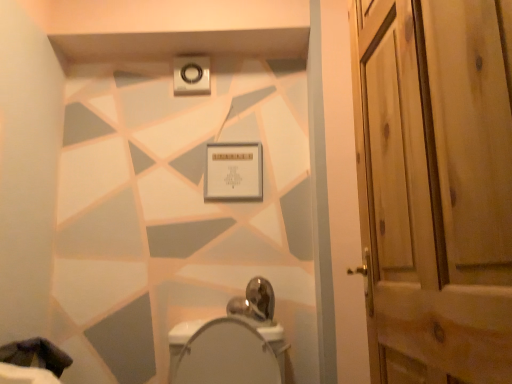
Question: Is white glossy bidet at center smaller than wooden door at right?

Choices:
 (A) no
 (B) yes

Answer: (A)

Question: Is white glossy bidet at center closer to the viewer compared to wooden door at right?

Choices:
 (A) yes
 (B) no

Answer: (B)

Question: Considering the relative sizes of white glossy bidet at center and wooden door at right in the image provided, is white glossy bidet at center taller than wooden door at right?

Choices:
 (A) yes
 (B) no

Answer: (B)

Question: Is wooden door at right completely or partially inside white glossy bidet at center?

Choices:
 (A) no
 (B) yes

Answer: (A)

Question: Is white glossy bidet at center shorter than wooden door at right?

Choices:
 (A) no
 (B) yes

Answer: (B)

Question: In terms of size, does white glossy bidet at center appear bigger or smaller than dark fabric at lower left?

Choices:
 (A) small
 (B) big

Answer: (B)

Question: From the image's perspective, is white glossy bidet at center located above or below dark fabric at lower left?

Choices:
 (A) above
 (B) below

Answer: (A)

Question: Is point (185, 344) closer or farther from the camera than point (31, 364)?

Choices:
 (A) closer
 (B) farther

Answer: (B)

Question: Is white glossy bidet at center inside or outside of dark fabric at lower left?

Choices:
 (A) inside
 (B) outside

Answer: (B)

Question: Relative to white glossy bidet at center, is wooden door at right in front or behind?

Choices:
 (A) behind
 (B) front

Answer: (B)

Question: Is wooden door at right taller or shorter than white glossy bidet at center?

Choices:
 (A) tall
 (B) short

Answer: (A)

Question: From the image's perspective, is wooden door at right located above or below white glossy bidet at center?

Choices:
 (A) below
 (B) above

Answer: (B)

Question: Visually, is wooden door at right positioned to the left or to the right of white glossy bidet at center?

Choices:
 (A) left
 (B) right

Answer: (B)

Question: Considering the positions of wooden door at right and dark fabric at lower left in the image, is wooden door at right bigger or smaller than dark fabric at lower left?

Choices:
 (A) big
 (B) small

Answer: (A)

Question: In terms of width, does wooden door at right look wider or thinner when compared to dark fabric at lower left?

Choices:
 (A) thin
 (B) wide

Answer: (A)